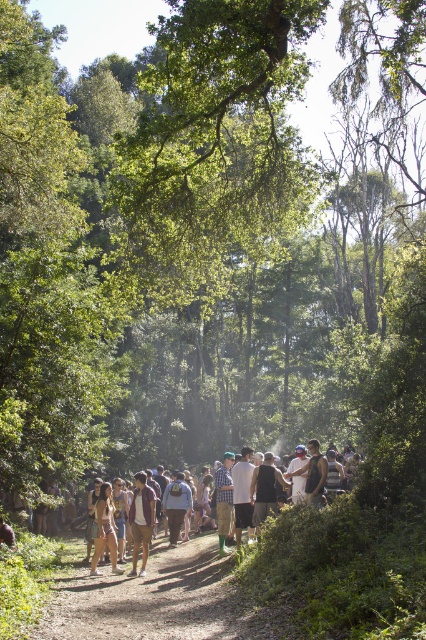
In the scene shown: How far apart are purple fabric shirt at center and dark gray shirt at center?

A distance of 2.70 meters exists between purple fabric shirt at center and dark gray shirt at center.

Between purple fabric shirt at center and dark gray shirt at center, which one is positioned lower?

purple fabric shirt at center is below.

Is point (152, 497) in front of point (256, 499)?

No.

What are the coordinates of `purple fabric shirt at center` in the screenshot? It's located at (141, 520).

This screenshot has width=426, height=640. Describe the element at coordinates (264, 488) in the screenshot. I see `dark gray shirt at center` at that location.

Where is `dark gray shirt at center`? dark gray shirt at center is located at coordinates (264, 488).

Is white cotton shirt at center thinner than checkered fabric shirt at center?

Yes, white cotton shirt at center is thinner than checkered fabric shirt at center.

Does white cotton shirt at center appear over checkered fabric shirt at center?

Correct, white cotton shirt at center is located above checkered fabric shirt at center.

Find the location of a particular element. white cotton shirt at center is located at coordinates (242, 492).

Where is `white cotton shirt at center`? This screenshot has height=640, width=426. white cotton shirt at center is located at coordinates (242, 492).